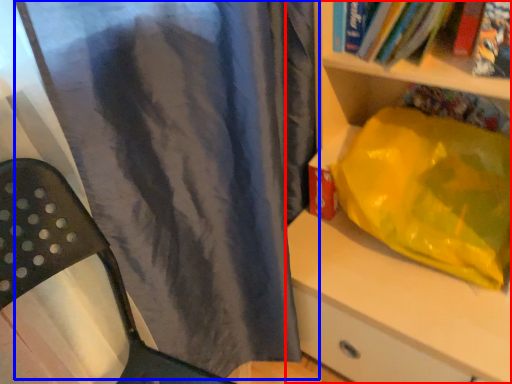
Question: Which object is further to the camera taking this photo, shelf (highlighted by a red box) or curtain (highlighted by a blue box)?

Choices:
 (A) shelf
 (B) curtain

Answer: (A)